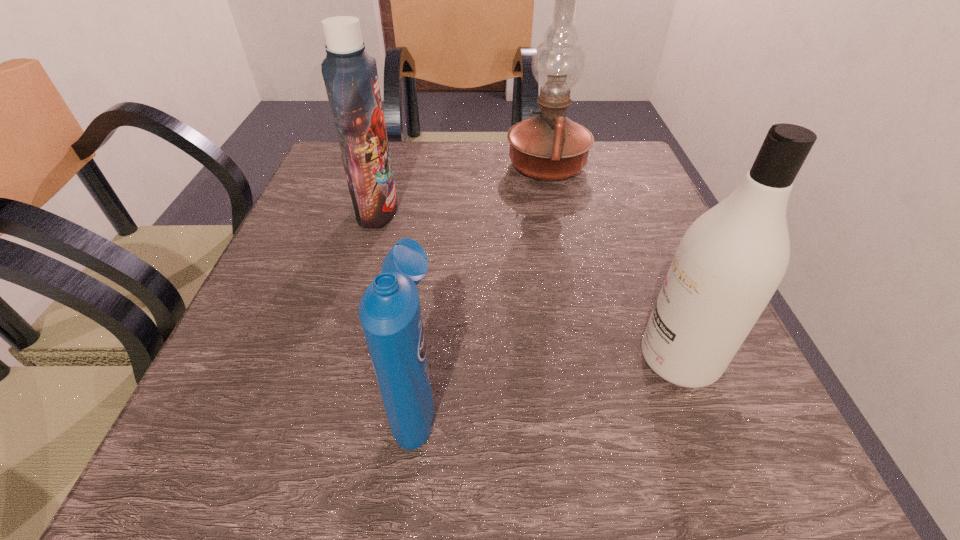
This screenshot has width=960, height=540. I want to click on free space that satisfies the following two spatial constraints: 1. on the back side of the oil lamp; 2. on the left side of the second shampoo from right to left, so click(444, 166).